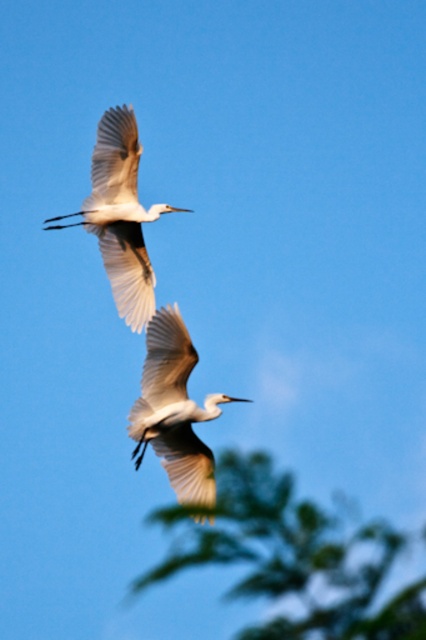
Question: Which object is the farthest from the white matte bird at upper left?

Choices:
 (A) white matte bird at center
 (B) green leafy tree at lower center

Answer: (B)

Question: Is white matte bird at center behind white matte bird at upper left?

Choices:
 (A) no
 (B) yes

Answer: (A)

Question: Is the position of green leafy tree at lower center less distant than that of white matte bird at upper left?

Choices:
 (A) no
 (B) yes

Answer: (B)

Question: Which object appears closest to the camera in this image?

Choices:
 (A) white matte bird at center
 (B) green leafy tree at lower center
 (C) white matte bird at upper left

Answer: (B)

Question: Observing the image, what is the correct spatial positioning of green leafy tree at lower center in reference to white matte bird at upper left?

Choices:
 (A) above
 (B) below

Answer: (B)

Question: Which object appears closest to the camera in this image?

Choices:
 (A) white matte bird at center
 (B) white matte bird at upper left
 (C) green leafy tree at lower center

Answer: (C)